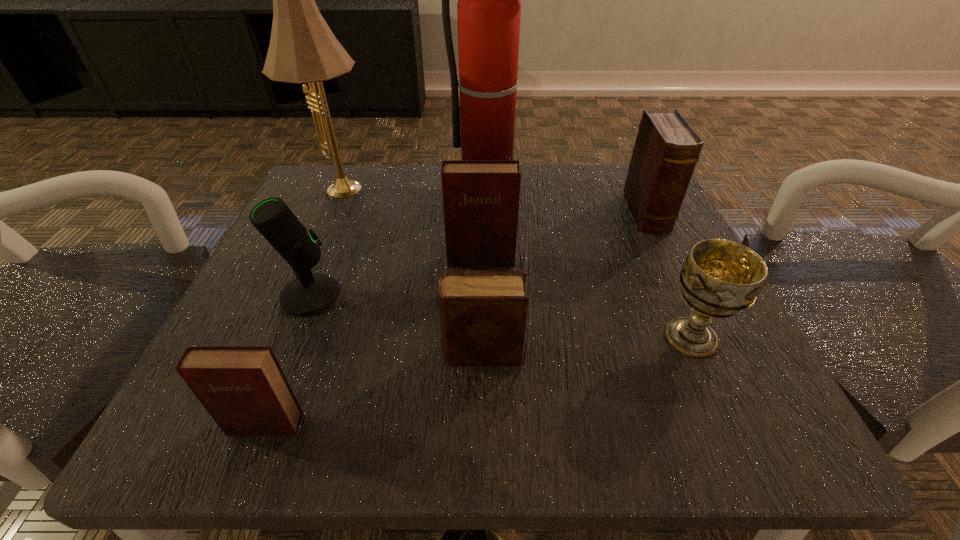
Identify the location of object situated at the far left corner. (303, 49).

In order to click on object present at the near left corner in this screenshot , I will do `click(243, 388)`.

Where is `object located at the far right corner`? object located at the far right corner is located at coordinates (666, 150).

The width and height of the screenshot is (960, 540). In the image, there is a desktop. In order to click on free space at the far edge in this screenshot , I will do `click(431, 166)`.

Image resolution: width=960 pixels, height=540 pixels. What are the coordinates of `vacant space at the left edge of the desktop` in the screenshot? It's located at (339, 302).

The height and width of the screenshot is (540, 960). In order to click on vacant space at the right edge of the desktop in this screenshot , I will do `click(615, 230)`.

This screenshot has width=960, height=540. I want to click on vacant space at the far left corner, so click(x=312, y=192).

Find the location of `vacant space at the far right corner of the desktop`. vacant space at the far right corner of the desktop is located at coordinates (612, 169).

Identify the location of free spot at the near right corner of the desktop. The width and height of the screenshot is (960, 540). (693, 398).

In order to click on blank region between the microphone and the red fire extinguisher in this screenshot , I will do `click(400, 242)`.